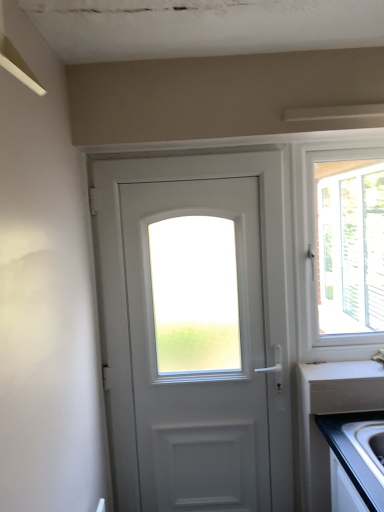
Question: Is white matte door at center wider than silver metallic faucet at right?

Choices:
 (A) yes
 (B) no

Answer: (B)

Question: Is the position of white matte door at center less distant than that of silver metallic faucet at right?

Choices:
 (A) no
 (B) yes

Answer: (A)

Question: Can you confirm if white matte door at center is thinner than silver metallic faucet at right?

Choices:
 (A) no
 (B) yes

Answer: (B)

Question: Is white matte door at center further to the viewer compared to silver metallic faucet at right?

Choices:
 (A) no
 (B) yes

Answer: (B)

Question: Is white matte door at center at the left side of silver metallic faucet at right?

Choices:
 (A) no
 (B) yes

Answer: (B)

Question: Does white matte door at center appear on the right side of silver metallic faucet at right?

Choices:
 (A) no
 (B) yes

Answer: (A)

Question: Is white laminate countertop at lower right wider than white matte door at center?

Choices:
 (A) no
 (B) yes

Answer: (B)

Question: Does white laminate countertop at lower right lie behind white matte door at center?

Choices:
 (A) no
 (B) yes

Answer: (B)

Question: From the image's perspective, would you say white laminate countertop at lower right is shown under white matte door at center?

Choices:
 (A) yes
 (B) no

Answer: (A)

Question: Is white laminate countertop at lower right not close to white matte door at center?

Choices:
 (A) no
 (B) yes

Answer: (A)

Question: From the image's perspective, is white laminate countertop at lower right above white matte door at center?

Choices:
 (A) yes
 (B) no

Answer: (B)

Question: From a real-world perspective, is white laminate countertop at lower right physically below white matte door at center?

Choices:
 (A) yes
 (B) no

Answer: (A)

Question: Is white laminate countertop at lower right bigger than silver metallic faucet at right?

Choices:
 (A) no
 (B) yes

Answer: (A)